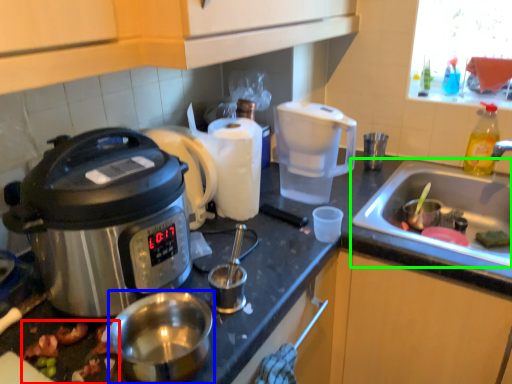
Question: Estimate the real-world distances between objects in this image. Which object is farther from food (highlighted by a red box), appliance (highlighted by a blue box) or sink (highlighted by a green box)?

Choices:
 (A) appliance
 (B) sink

Answer: (B)